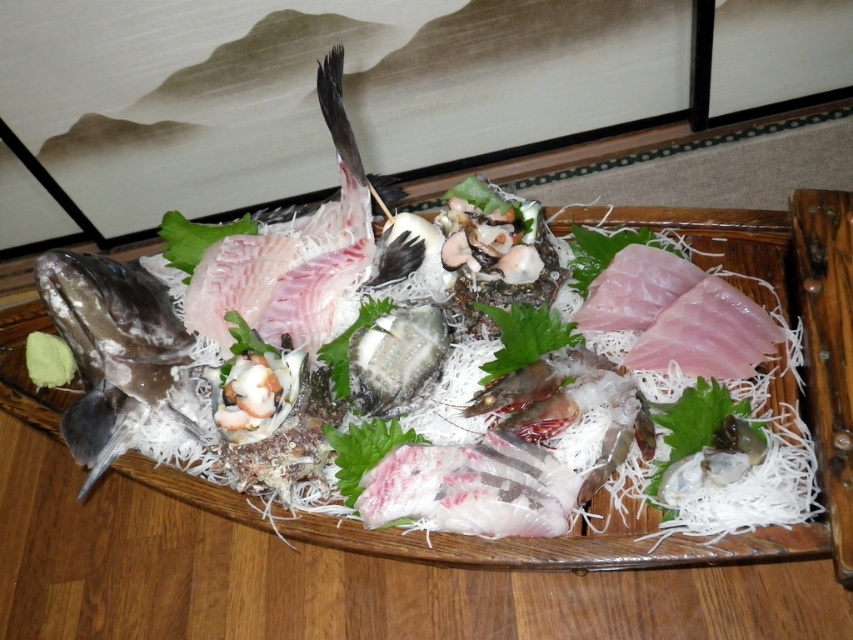
Which of these two, pinkish-white fish at center or shiny silver fish at left, stands taller?

With more height is pinkish-white fish at center.

Is point (770, 234) closer to viewer compared to point (140, 394)?

Yes.

In order to click on pinkish-white fish at center in this screenshot , I will do `click(587, 541)`.